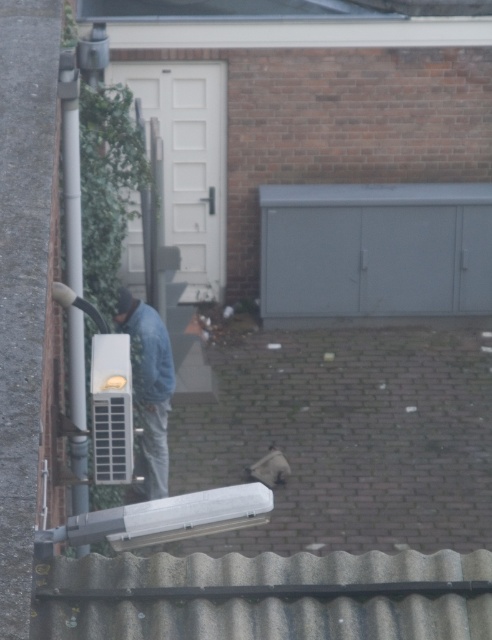
Can you confirm if white matte garage door at upper center is thinner than denim jacket at center?

In fact, white matte garage door at upper center might be wider than denim jacket at center.

Who is more distant from viewer, (171, 164) or (134, 326)?

The point (171, 164) is more distant.

Between point (142, 273) and point (170, 369), which one is positioned in front?

Point (170, 369) is in front.

The height and width of the screenshot is (640, 492). In order to click on white matte garage door at upper center in this screenshot , I will do `click(187, 163)`.

Between point (186, 145) and point (130, 481), which one is positioned behind?

The point (186, 145) is more distant.

Is point (206, 268) less distant than point (97, 422)?

No, it is not.

Locate an element on the screen. white matte garage door at upper center is located at coordinates (187, 163).

Can you confirm if smooth gray roof at upper center is positioned above white plastic air conditioner at lower left?

Correct, smooth gray roof at upper center is located above white plastic air conditioner at lower left.

Is smooth gray roof at upper center below white plastic air conditioner at lower left?

No.

Locate an element on the screen. The image size is (492, 640). smooth gray roof at upper center is located at coordinates 274,8.